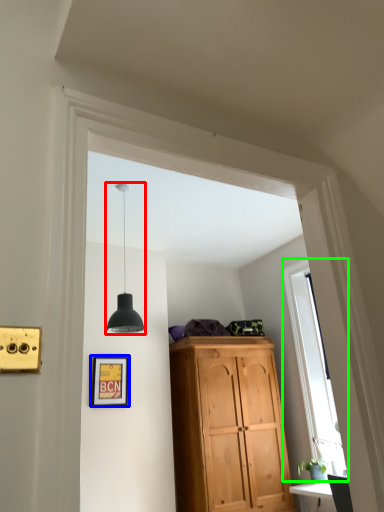
Question: Which object is positioned closest to light fixture (highlighted by a red box)? Select from picture frame (highlighted by a blue box) and window (highlighted by a green box).

Choices:
 (A) picture frame
 (B) window

Answer: (A)